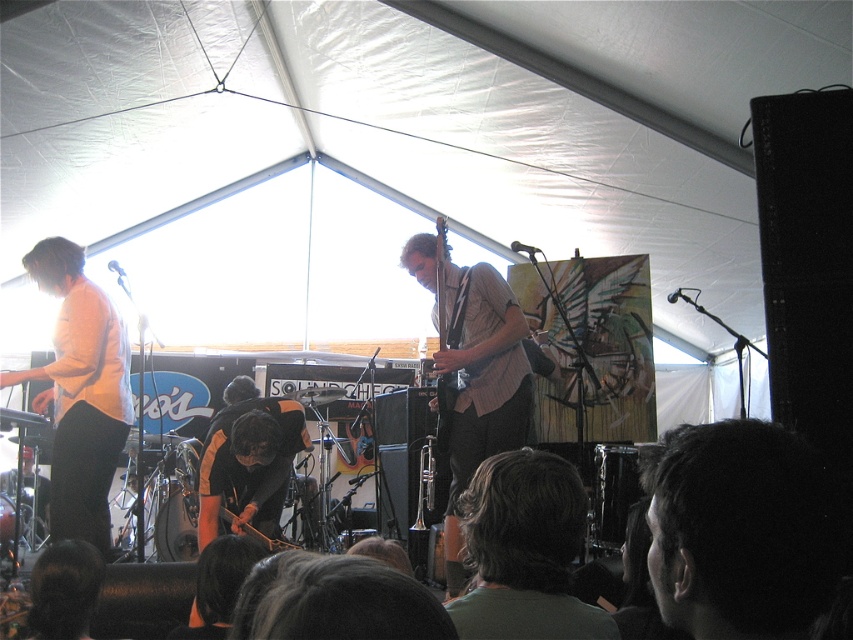
You are a photographer at the back of the audience trying to take a clear picture of the light brown textured shirt at center without the dark brown hair at lower center blocking it. What should you do?

Move to a position where you can see the light brown textured shirt at center without the dark brown hair at lower center in front of it, since the dark brown hair at lower center is blocking the view from your current angle.

You are a photographer at the back of the audience trying to capture a clear photo of the dark brown hair at lower center and the wooden acoustic guitar at center. Which object might be blocking your view of the other?

The dark brown hair at lower center is positioned under the wooden acoustic guitar at center, so the wooden acoustic guitar at center might be blocking the view of the dark brown hair at lower center.

In the image of the live music performance, there is a point marked at coordinates (524, 552). What object or feature is located at this point?

The point at coordinates (524, 552) marks the location of the dark brown hair at lower center.